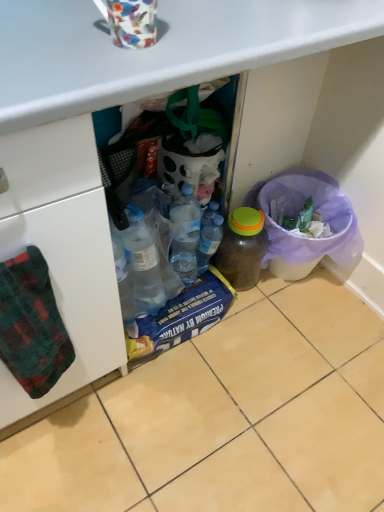
Question: Considering the relative sizes of translucent plastic bin at lower right and translucent plastic bottle at center, the 2th bottle viewed from the right, in the image provided, is translucent plastic bin at lower right bigger than translucent plastic bottle at center, the 2th bottle viewed from the right,?

Choices:
 (A) no
 (B) yes

Answer: (B)

Question: Is translucent plastic bin at lower right thinner than translucent plastic bottle at center, which is the first bottle from left to right?

Choices:
 (A) no
 (B) yes

Answer: (A)

Question: Does translucent plastic bin at lower right lie in front of translucent plastic bottle at center, the 2th bottle viewed from the right?

Choices:
 (A) yes
 (B) no

Answer: (A)

Question: Would you say translucent plastic bin at lower right contains translucent plastic bottle at center, which is the first bottle from left to right?

Choices:
 (A) yes
 (B) no

Answer: (B)

Question: From a real-world perspective, is translucent plastic bin at lower right physically below translucent plastic bottle at center, the 2th bottle viewed from the right?

Choices:
 (A) no
 (B) yes

Answer: (B)

Question: Choose the correct answer: Is translucent plastic bin at lower right inside beige tile at lower center or outside it?

Choices:
 (A) outside
 (B) inside

Answer: (A)

Question: Does point (309, 262) appear closer or farther from the camera than point (294, 452)?

Choices:
 (A) farther
 (B) closer

Answer: (A)

Question: In terms of size, does translucent plastic bin at lower right appear bigger or smaller than beige tile at lower center?

Choices:
 (A) small
 (B) big

Answer: (A)

Question: Considering the positions of translucent plastic bin at lower right and beige tile at lower center in the image, is translucent plastic bin at lower right wider or thinner than beige tile at lower center?

Choices:
 (A) thin
 (B) wide

Answer: (A)

Question: Considering the positions of green plaid towel at left and floral-patterned ceramic mug at upper center in the image, is green plaid towel at left wider or thinner than floral-patterned ceramic mug at upper center?

Choices:
 (A) wide
 (B) thin

Answer: (B)

Question: Visually, is green plaid towel at left positioned to the left or to the right of floral-patterned ceramic mug at upper center?

Choices:
 (A) right
 (B) left

Answer: (B)

Question: In terms of height, does green plaid towel at left look taller or shorter compared to floral-patterned ceramic mug at upper center?

Choices:
 (A) tall
 (B) short

Answer: (A)

Question: From the image's perspective, is green plaid towel at left located above or below floral-patterned ceramic mug at upper center?

Choices:
 (A) below
 (B) above

Answer: (A)

Question: Considering the positions of point (344, 375) and point (137, 41), is point (344, 375) closer or farther from the camera than point (137, 41)?

Choices:
 (A) farther
 (B) closer

Answer: (A)

Question: Looking at their shapes, would you say beige tile at lower center is wider or thinner than floral-patterned ceramic mug at upper center?

Choices:
 (A) thin
 (B) wide

Answer: (B)